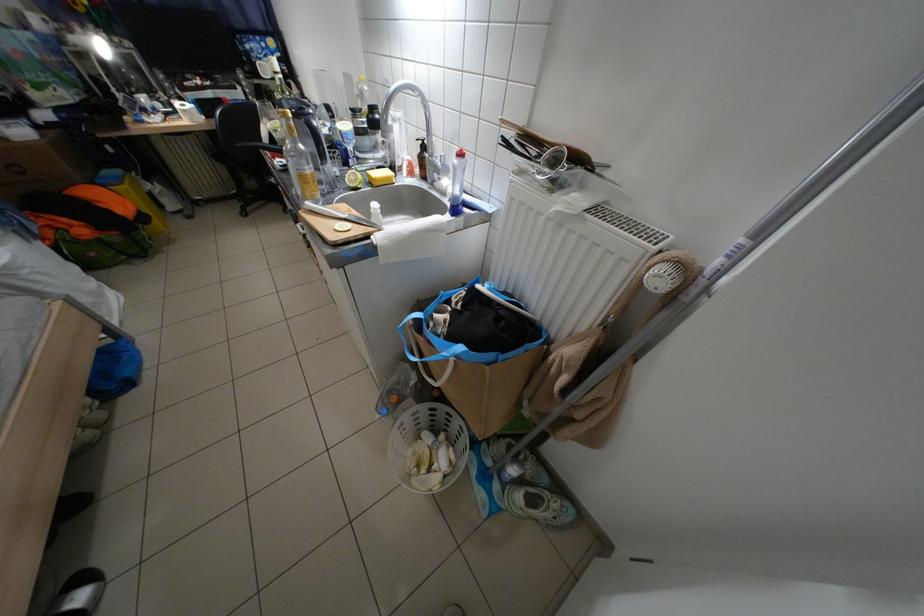
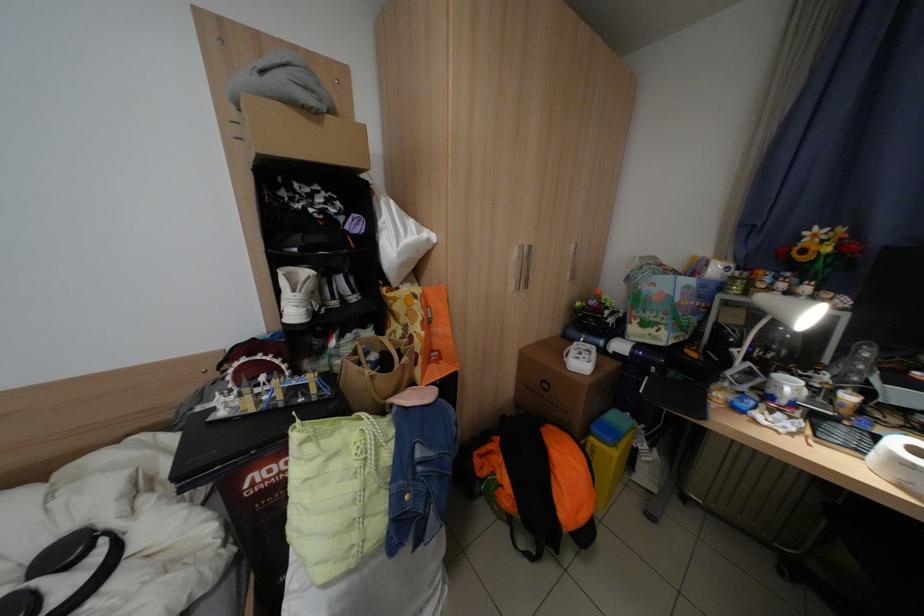
In the second image, find the point that corresponds to point (131, 98) in the first image.

(752, 366)